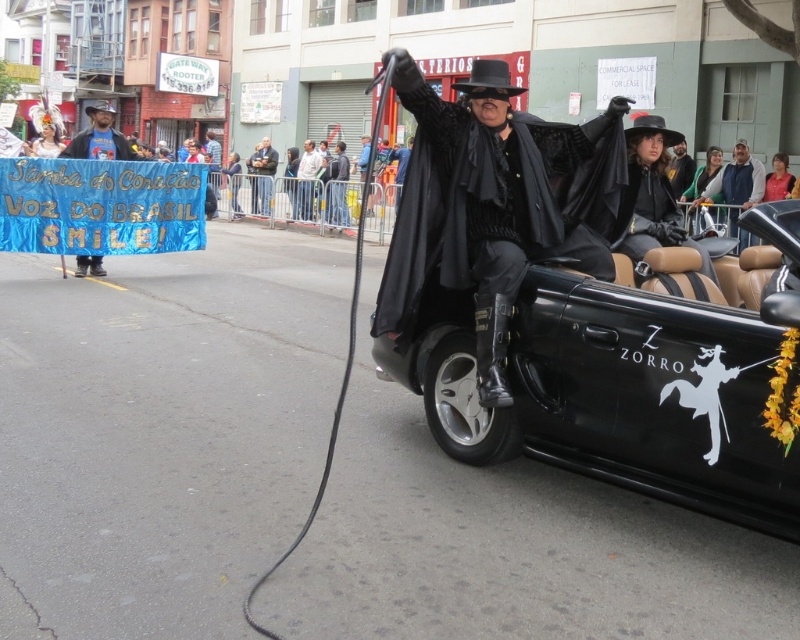
Question: Where is black matte cloak at center located in relation to pink fabric shirt at upper right in the image?

Choices:
 (A) above
 (B) below

Answer: (B)

Question: Estimate the real-world distances between objects in this image. Which object is farther from the black leather jacket at center?

Choices:
 (A) black matte cloak at center
 (B) pink fabric shirt at upper right

Answer: (A)

Question: Among these points, which one is nearest to the camera?

Choices:
 (A) (790, 192)
 (B) (256, 192)
 (C) (104, 272)
 (D) (588, 410)

Answer: (D)

Question: Among these points, which one is nearest to the camera?

Choices:
 (A) (274, 150)
 (B) (440, 225)

Answer: (B)

Question: Is black leather convertible at center positioned behind pink fabric shirt at upper right?

Choices:
 (A) yes
 (B) no

Answer: (B)

Question: Does black leather jacket at center have a greater width compared to pink fabric shirt at upper right?

Choices:
 (A) no
 (B) yes

Answer: (B)